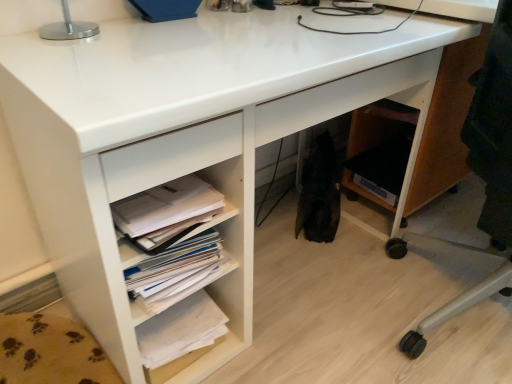
At what (x,y) coordinates should I click in order to perform the action: click on free point below wooden office chair at lower right (from a real-world perspective). Please return your answer as a coordinate pair (x, y). The height and width of the screenshot is (384, 512). Looking at the image, I should click on (432, 310).